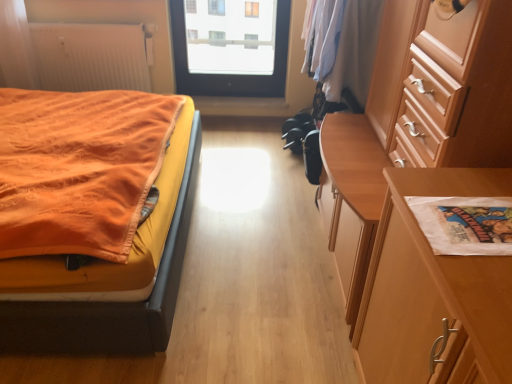
Question: Looking at their shapes, would you say white paper bag at right is wider or thinner than white paper at right?

Choices:
 (A) wide
 (B) thin

Answer: (A)

Question: Considering their positions, is white paper bag at right located in front of or behind white paper at right?

Choices:
 (A) behind
 (B) front

Answer: (B)

Question: Based on their relative distances, which object is nearer to the white paper at right?

Choices:
 (A) white paper bag at right
 (B) white ribbed radiator at upper left
 (C) wooden chest of drawers at right
 (D) orange fabric bed at left
 (E) transparent glass door at upper center

Answer: (A)

Question: Considering the real-world distances, which object is closest to the transparent glass door at upper center?

Choices:
 (A) orange fabric bed at left
 (B) white ribbed radiator at upper left
 (C) white paper bag at right
 (D) wooden chest of drawers at right
 (E) white paper at right

Answer: (B)